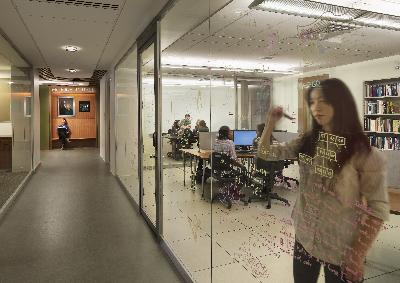
Identify the location of framed picture. The height and width of the screenshot is (283, 400). (66, 104), (87, 105).